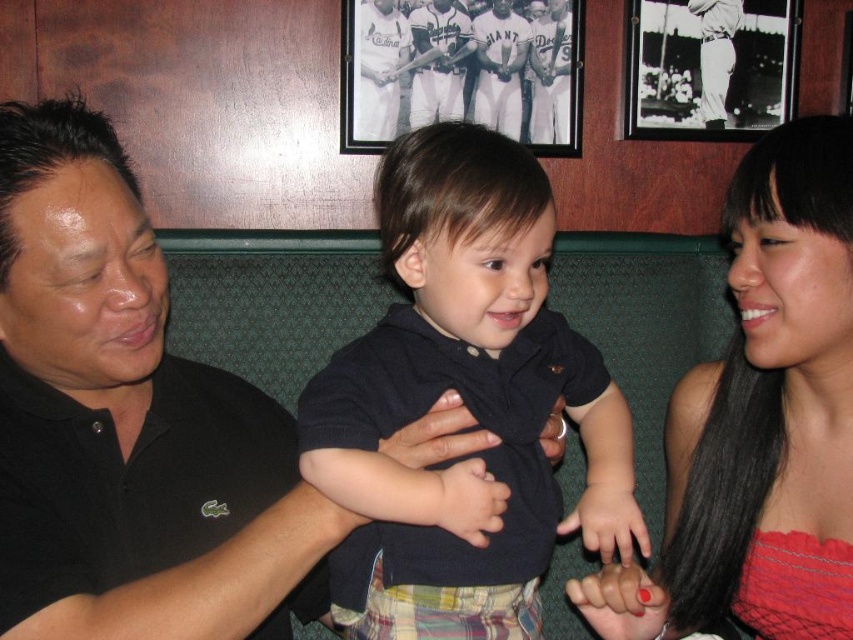
Question: Observing the image, what is the correct spatial positioning of dark blue cotton shirt at center in reference to matte black dress at center?

Choices:
 (A) above
 (B) below

Answer: (B)

Question: Is matte black dress at center above black matte picture frame at upper center?

Choices:
 (A) yes
 (B) no

Answer: (B)

Question: Estimate the real-world distances between objects in this image. Which object is closer to the white baseball uniform at upper center?

Choices:
 (A) black matte picture frame at upper center
 (B) dark blue cotton shirt at center
 (C) wooden framed photograph at upper center
 (D) white baseball uniform at center

Answer: (A)

Question: Which point is closer to the camera taking this photo?

Choices:
 (A) (419, 484)
 (B) (718, 35)
 (C) (733, 40)
 (D) (393, 83)

Answer: (A)

Question: Is dark blue cotton shirt at center thinner than black matte picture frame at upper center?

Choices:
 (A) yes
 (B) no

Answer: (A)

Question: Which is nearer to the white cotton baseball uniform at center?

Choices:
 (A) dark blue cotton shirt at center
 (B) wooden framed photograph at upper center
 (C) white baseball uniform at upper center

Answer: (B)